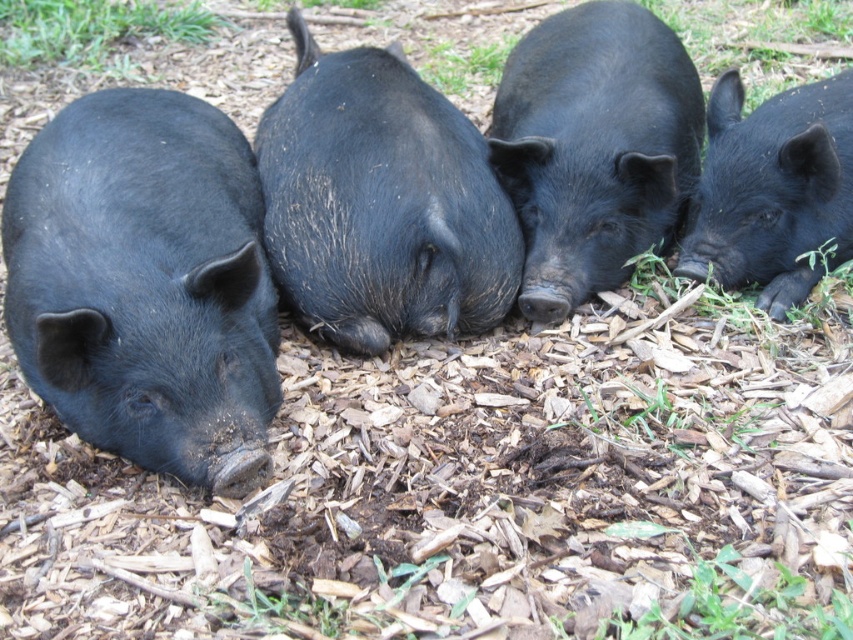
You are standing at the origin point in this image and want to locate the matte black pig at left. According to the coordinates provided, in which direction should you look to find it?

The matte black pig at left is located at coordinates point 0.445 on the x axis and 0.172 on the y axis. Since the origin is at the bottom left corner of the image, you should look to the upper right direction from the origin point to find the matte black pig at left.

You are a farmer checking on your animals. You notice the black matte pig at right and the green grass at upper left. Which one is smaller in size?

The black matte pig at right is smaller than the green grass at upper left.